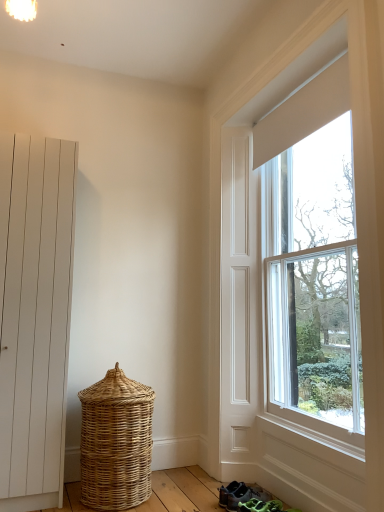
This screenshot has height=512, width=384. I want to click on woven natural basket at lower left, so click(x=116, y=442).

What is the approximate height of clear glass window at right?

It is 8.94 feet.

At what (x,y) coordinates should I click in order to perform the action: click on clear glass window at right. Please return your answer as a coordinate pair (x, y). Looking at the image, I should click on [311, 260].

Image resolution: width=384 pixels, height=512 pixels. What are the coordinates of `white matte door at left` in the screenshot? It's located at 34,316.

From a real-world perspective, is gray fabric sneakers at lower center beneath white matte door at left?

Yes.

Is gray fabric sneakers at lower center facing towards white matte door at left?

No, gray fabric sneakers at lower center is not facing towards white matte door at left.

Does gray fabric sneakers at lower center appear on the right side of white matte door at left?

Yes, gray fabric sneakers at lower center is to the right of white matte door at left.

Considering the positions of points (230, 508) and (9, 319), is point (230, 508) closer to camera compared to point (9, 319)?

Yes, it is in front of point (9, 319).

From a real-world perspective, is white matte door at left positioned over gray fabric sneakers at lower center based on gravity?

Yes.

From the image's perspective, who appears lower, white matte door at left or gray fabric sneakers at lower center?

gray fabric sneakers at lower center.

Does point (36, 320) come in front of point (226, 489)?

Yes, it is.

How many degrees apart are the facing directions of clear glass window at right and white matte door at left?

clear glass window at right and white matte door at left are facing 89.3 degrees away from each other.

Find the location of a particular element. This screenshot has height=512, width=384. window above the white matte door at left (from a real-world perspective) is located at coordinates (311, 260).

Consider the image. Can you confirm if clear glass window at right is smaller than white matte door at left?

Indeed, clear glass window at right has a smaller size compared to white matte door at left.

Relative to white matte door at left, is clear glass window at right in front or behind?

clear glass window at right is in front of white matte door at left.

How far apart are woven natural basket at lower left and clear glass window at right?

woven natural basket at lower left is 1.24 meters from clear glass window at right.

Would you say woven natural basket at lower left is inside or outside clear glass window at right?

The correct answer is: outside.

Consider the image. How different are the orientations of woven natural basket at lower left and clear glass window at right in degrees?

There is a 89.3-degree angle between the facing directions of woven natural basket at lower left and clear glass window at right.

Considering the positions of objects woven natural basket at lower left and clear glass window at right in the image provided, who is more to the right, woven natural basket at lower left or clear glass window at right?

clear glass window at right.

What's the angular difference between white matte door at left and clear glass window at right's facing directions?

They differ by 89.3 degrees in their facing directions.

Is point (10, 226) positioned behind point (349, 218)?

Yes.

Is white matte door at left turned away from clear glass window at right?

white matte door at left is not turned away from clear glass window at right.

Identify the location of door that appears below the clear glass window at right (from a real-world perspective). (34, 316).

Where is `basket above the gray fabric sneakers at lower center (from a real-world perspective)`? basket above the gray fabric sneakers at lower center (from a real-world perspective) is located at coordinates (116, 442).

Looking at this image, from the image's perspective, would you say woven natural basket at lower left is shown under gray fabric sneakers at lower center?

Actually, woven natural basket at lower left appears above gray fabric sneakers at lower center in the image.

Considering the relative sizes of woven natural basket at lower left and gray fabric sneakers at lower center in the image provided, is woven natural basket at lower left thinner than gray fabric sneakers at lower center?

No, woven natural basket at lower left is not thinner than gray fabric sneakers at lower center.

Can you confirm if woven natural basket at lower left is taller than gray fabric sneakers at lower center?

Indeed, woven natural basket at lower left has a greater height compared to gray fabric sneakers at lower center.

Measure the distance between clear glass window at right and woven natural basket at lower left.

They are 4.06 feet apart.

Is clear glass window at right touching woven natural basket at lower left?

No, clear glass window at right is not in contact with woven natural basket at lower left.

Is woven natural basket at lower left completely or partially inside clear glass window at right?

Actually, woven natural basket at lower left is outside clear glass window at right.

Is the position of clear glass window at right less distant than that of woven natural basket at lower left?

Yes, the depth of clear glass window at right is less than that of woven natural basket at lower left.

Locate an element on the screen. door in front of the gray fabric sneakers at lower center is located at coordinates (34, 316).

What are the coordinates of `door above the gray fabric sneakers at lower center (from the image's perspective)` in the screenshot? It's located at (x=34, y=316).

Estimate the real-world distances between objects in this image. Which object is closer to woven natural basket at lower left, clear glass window at right or gray fabric sneakers at lower center?

gray fabric sneakers at lower center lies closer to woven natural basket at lower left than the other object.

From the picture: When comparing their distances from clear glass window at right, does white matte door at left or gray fabric sneakers at lower center seem further?

Based on the image, white matte door at left appears to be further to clear glass window at right.

From the image, which object appears to be nearer to woven natural basket at lower left, white matte door at left or gray fabric sneakers at lower center?

white matte door at left is positioned closer to the anchor woven natural basket at lower left.

Estimate the real-world distances between objects in this image. Which object is closer to clear glass window at right, gray fabric sneakers at lower center or woven natural basket at lower left?

woven natural basket at lower left is positioned closer to the anchor clear glass window at right.

Considering their positions, is woven natural basket at lower left positioned further to white matte door at left than gray fabric sneakers at lower center?

Based on the image, gray fabric sneakers at lower center appears to be further to white matte door at left.

Based on their spatial positions, is gray fabric sneakers at lower center or white matte door at left further from clear glass window at right?

white matte door at left.

Based on their spatial positions, is gray fabric sneakers at lower center or clear glass window at right further from white matte door at left?

clear glass window at right is positioned further to the anchor white matte door at left.

Estimate the real-world distances between objects in this image. Which object is closer to woven natural basket at lower left, gray fabric sneakers at lower center or clear glass window at right?

gray fabric sneakers at lower center.

At what (x,y) coordinates should I click in order to perform the action: click on basket between clear glass window at right and gray fabric sneakers at lower center in the up-down direction. Please return your answer as a coordinate pair (x, y). This screenshot has width=384, height=512. Looking at the image, I should click on (116, 442).

You are a GUI agent. You are given a task and a screenshot of the screen. Output one action in this format:
    pyautogui.click(x=<x>, y=<y>)
    Task: Click on the footwear between white matte door at left and clear glass window at right in the horizontal direction
    
    Given the screenshot: What is the action you would take?
    pyautogui.click(x=240, y=495)

Where is `basket between white matte door at left and gray fabric sneakers at lower center in the horizontal direction`? The width and height of the screenshot is (384, 512). basket between white matte door at left and gray fabric sneakers at lower center in the horizontal direction is located at coordinates (116, 442).

At what (x,y) coordinates should I click in order to perform the action: click on basket between white matte door at left and clear glass window at right. Please return your answer as a coordinate pair (x, y). The width and height of the screenshot is (384, 512). Looking at the image, I should click on (116, 442).